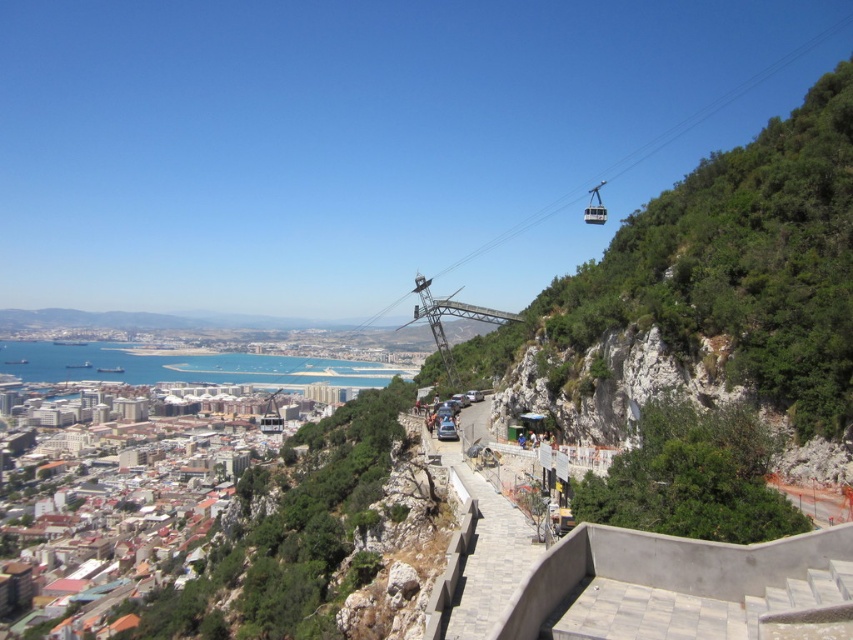
You are planning to take a cable car ride from the lower station to the upper station. The two cable cars you see, the metallic cable car at upper center and the metallic cable car at center, are part of the same system. How far apart are these two cable cars in feet?

The metallic cable car at upper center and the metallic cable car at center are 510.02 feet apart from each other.

You are standing at the bottom of the hill and want to take the cable car to the top. Based on the image, where is the metallic cable car at upper center located in relation to your current position?

The metallic cable car at upper center is located at point (595,205) in the image, so it is positioned above and to the right of your current position at the bottom of the hill.